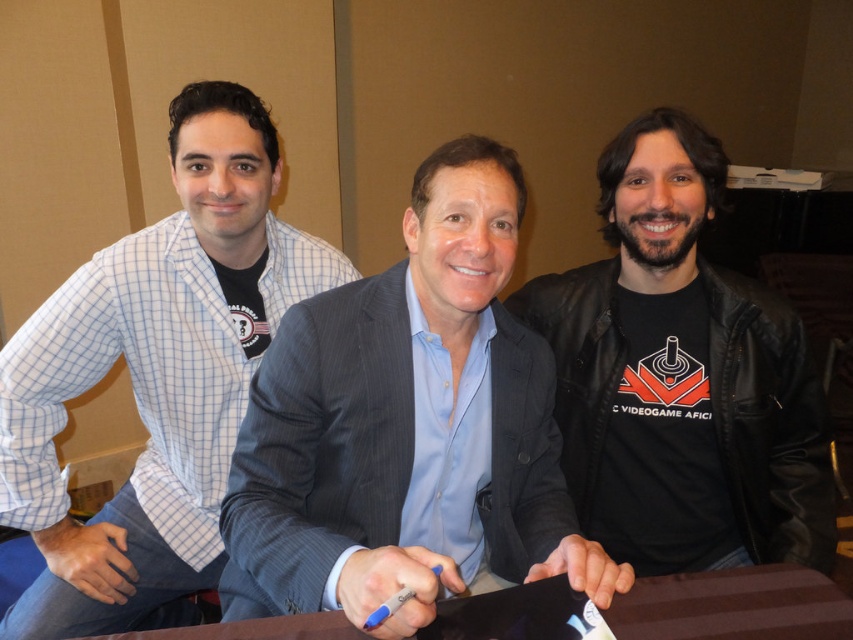
Question: Which point appears closest to the camera in this image?

Choices:
 (A) (190, 323)
 (B) (669, 204)
 (C) (624, 604)

Answer: (C)

Question: Which point is farther to the camera?

Choices:
 (A) (679, 244)
 (B) (387, 611)
 (C) (643, 595)
 (D) (341, 392)

Answer: (A)

Question: Does black leather jacket at right appear over brown wooden table at center?

Choices:
 (A) no
 (B) yes

Answer: (B)

Question: Is black leather jacket at right above brown wooden table at center?

Choices:
 (A) yes
 (B) no

Answer: (A)

Question: Which point is closer to the camera?

Choices:
 (A) blue plastic pen at center
 (B) brown wooden table at center

Answer: (A)

Question: Considering the relative positions of white checkered shirt at left and blue plastic pen at center in the image provided, where is white checkered shirt at left located with respect to blue plastic pen at center?

Choices:
 (A) right
 (B) left

Answer: (B)